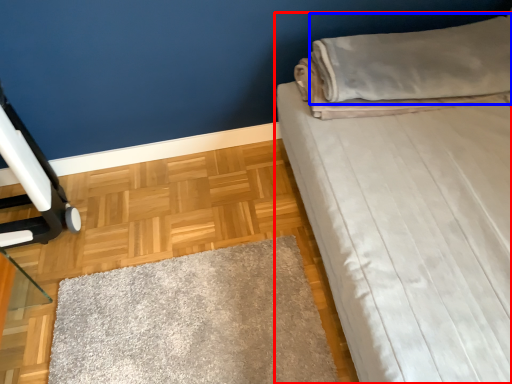
Question: Among these objects, which one is farthest to the camera, bed (highlighted by a red box) or pillow (highlighted by a blue box)?

Choices:
 (A) bed
 (B) pillow

Answer: (B)